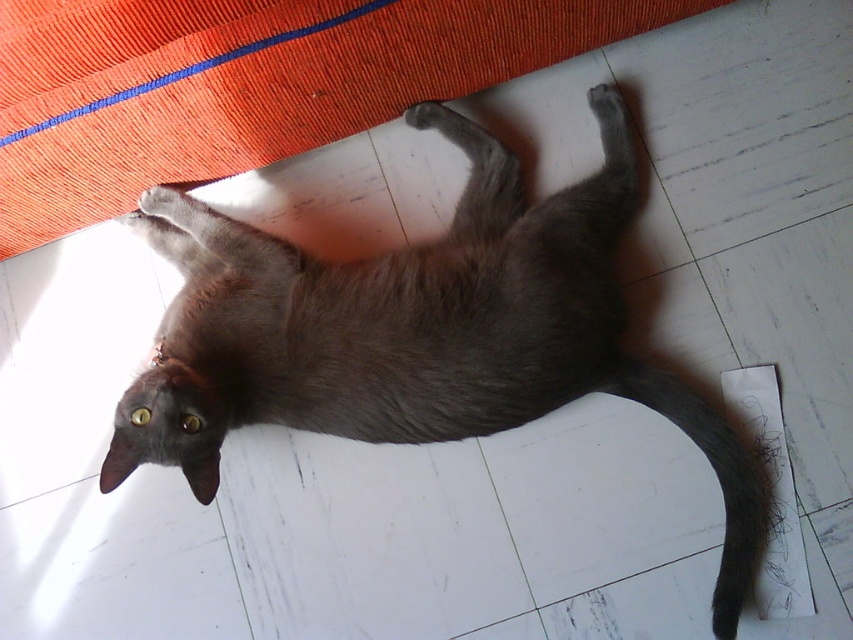
Question: Is gray fur cat at center to the right of gray fur tail at lower right from the viewer's perspective?

Choices:
 (A) yes
 (B) no

Answer: (B)

Question: Which point is closer to the camera?

Choices:
 (A) (764, 481)
 (B) (155, 400)

Answer: (B)

Question: Which point is farther from the camera taking this photo?

Choices:
 (A) (596, 330)
 (B) (608, 364)

Answer: (B)

Question: Among these objects, which one is nearest to the camera?

Choices:
 (A) gray fur tail at lower right
 (B) gray fur cat at center

Answer: (B)

Question: Is gray fur cat at center closer to the viewer compared to gray fur tail at lower right?

Choices:
 (A) no
 (B) yes

Answer: (B)

Question: Considering the relative positions of gray fur cat at center and gray fur tail at lower right in the image provided, where is gray fur cat at center located with respect to gray fur tail at lower right?

Choices:
 (A) right
 (B) left

Answer: (B)